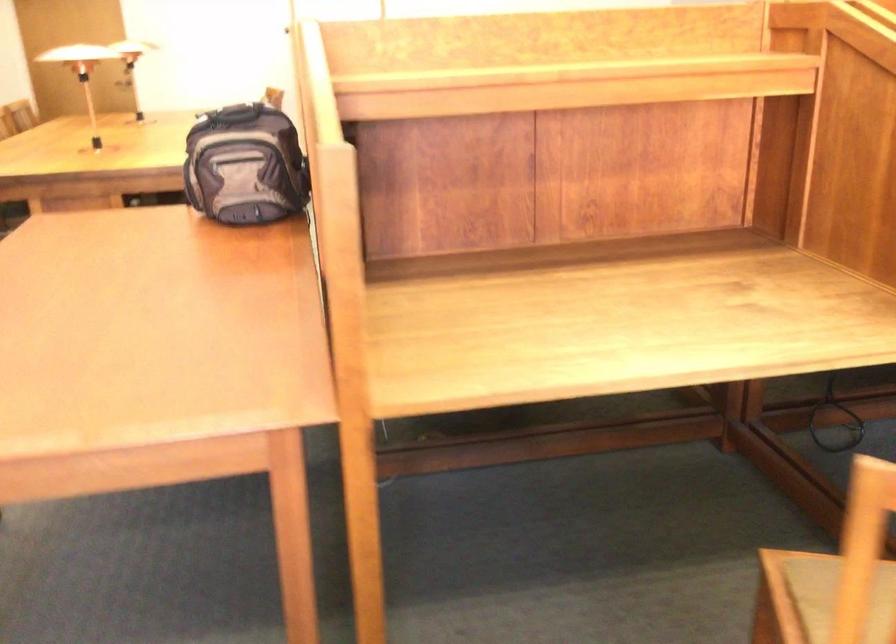
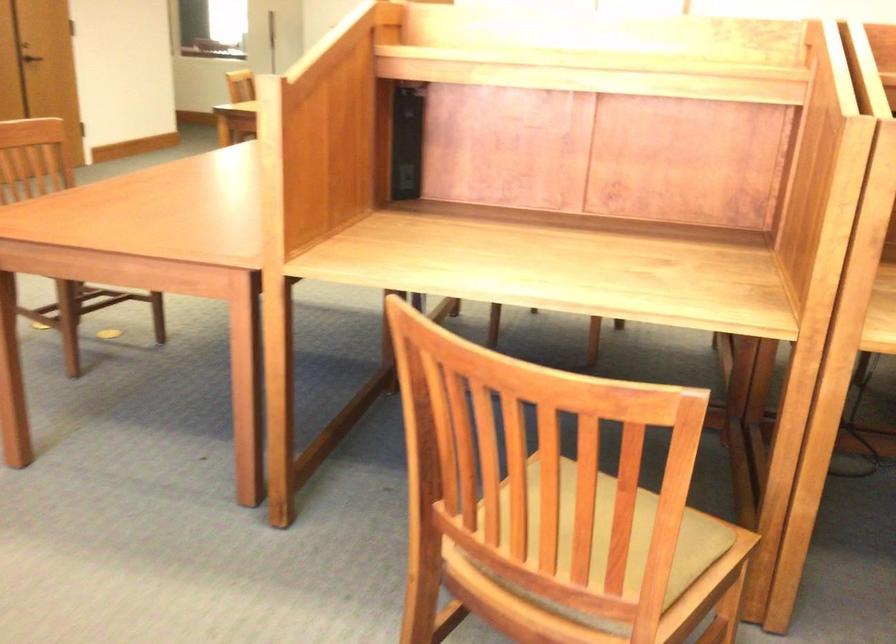
Question: The camera is either moving clockwise (left) or counter-clockwise (right) around the object. The first image is from the beginning of the video and the second image is from the end. Is the camera moving left or right when shooting the video?

Choices:
 (A) Left
 (B) Right

Answer: (B)